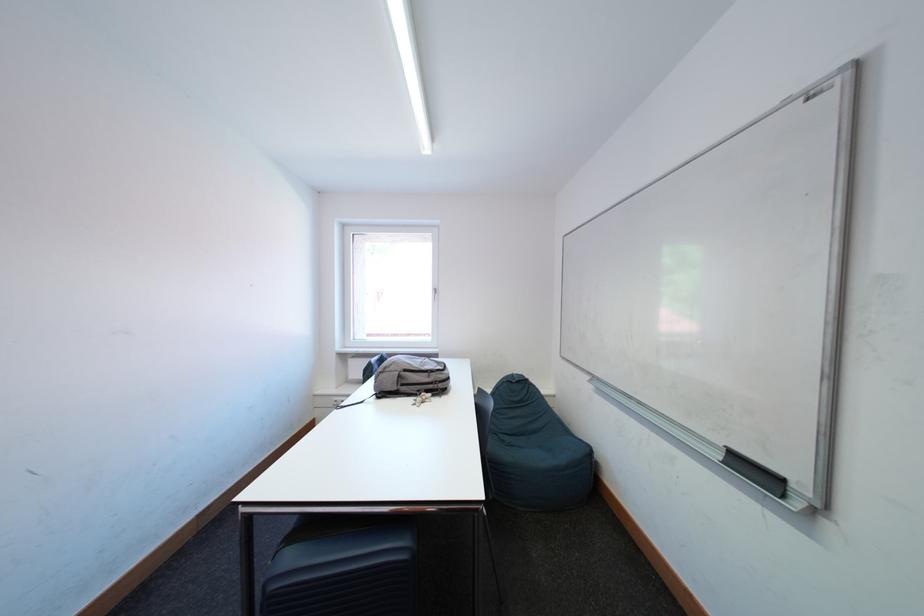
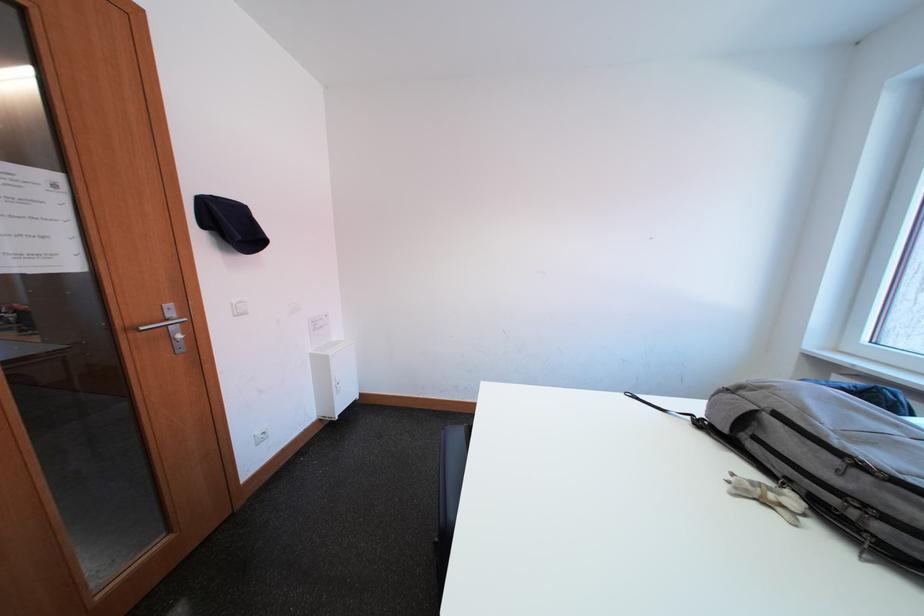
In the second image, find the point that corresponds to (395,400) in the first image.

(719, 438)